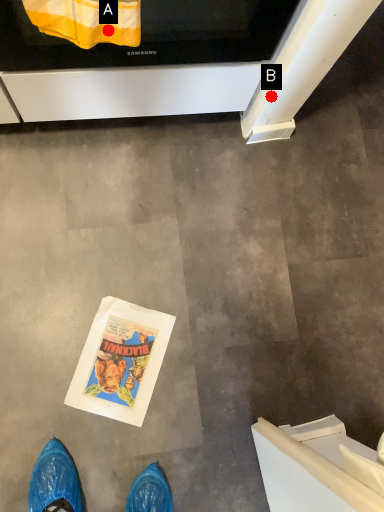
Question: Two points are circled on the image, labeled by A and B beside each circle. Which point is closer to the camera?

Choices:
 (A) A is closer
 (B) B is closer

Answer: (A)